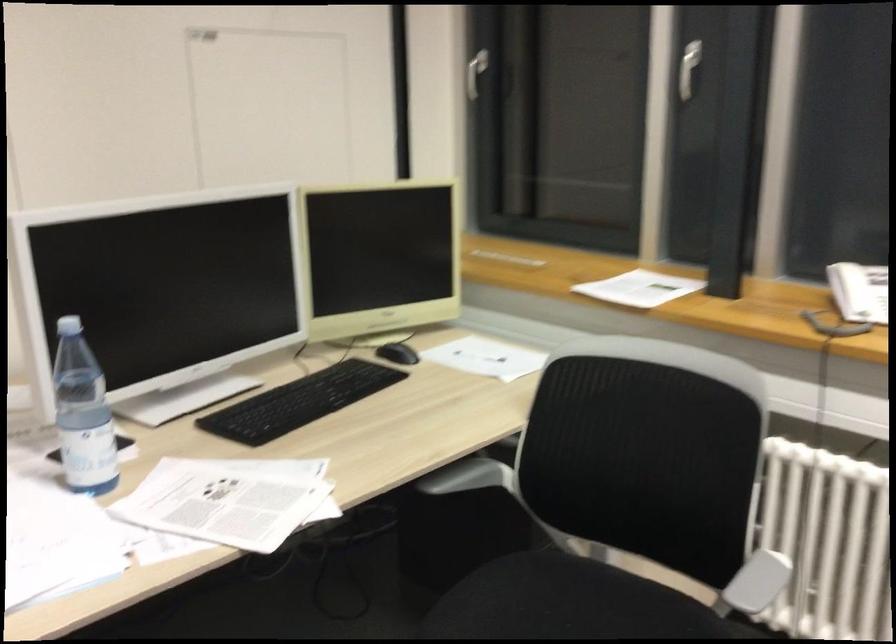
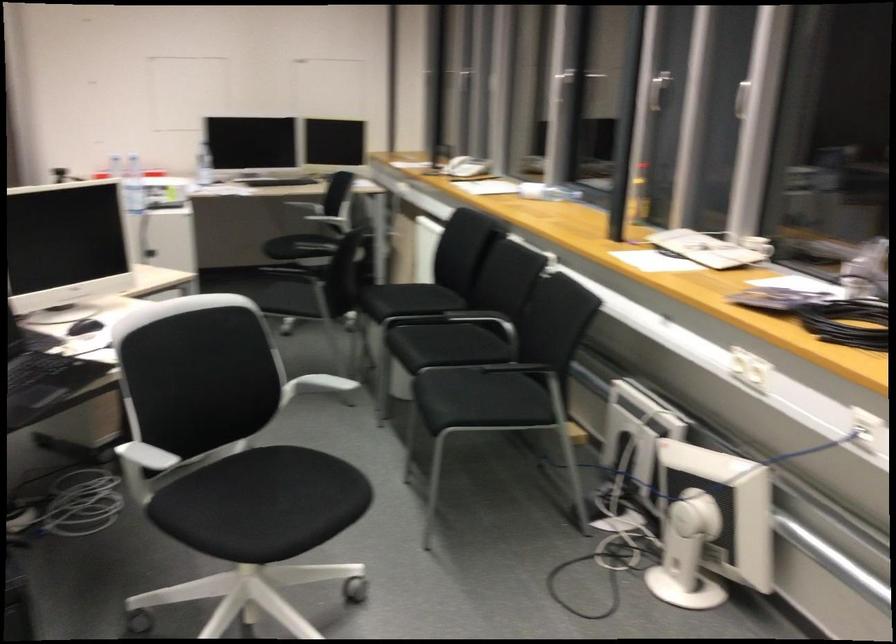
Where in the second image is the point corresponding to point 570,603 from the first image?

(319, 236)